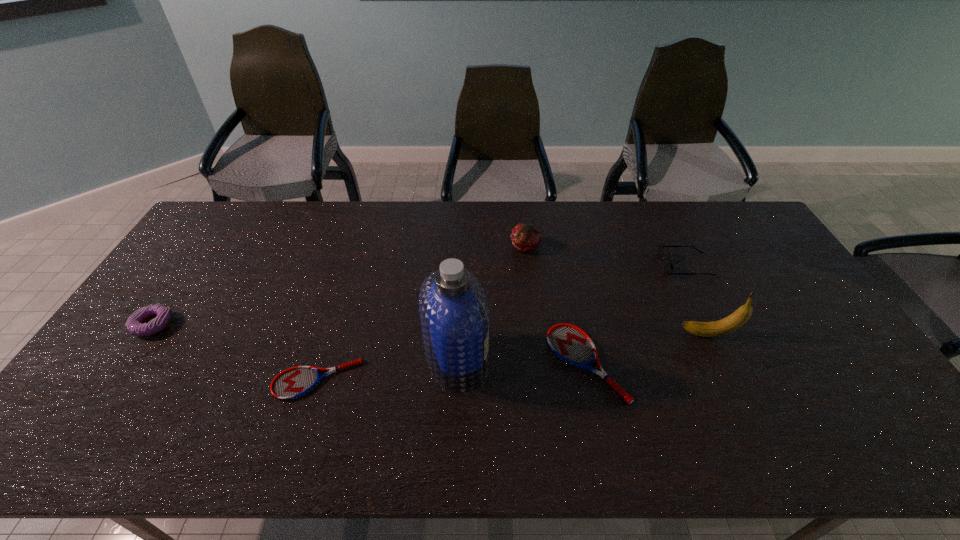
Locate an element on the screen. The height and width of the screenshot is (540, 960). cleansing agent is located at coordinates (454, 310).

Identify the location of free space located 0.190m on the left of the sixth object from right to left. The height and width of the screenshot is (540, 960). (201, 380).

Where is `free region located on the back of the second shortest object`? free region located on the back of the second shortest object is located at coordinates tap(563, 251).

Where is `free space located on the front of the fifth shortest object`? This screenshot has height=540, width=960. free space located on the front of the fifth shortest object is located at coordinates (534, 322).

At what (x,y) coordinates should I click in order to perform the action: click on free spot located 0.240m at the start of the peel on the banana. Please return your answer as a coordinate pair (x, y). Looking at the image, I should click on (593, 334).

You are a GUI agent. You are given a task and a screenshot of the screen. Output one action in this format:
    pyautogui.click(x=<x>, y=<y>)
    Task: Click on the vacant space situated at the start of the peel on the banana
    
    Given the screenshot: What is the action you would take?
    pyautogui.click(x=561, y=334)

Locate an element on the screen. Image resolution: width=960 pixels, height=540 pixels. vacant space located 0.320m at the start of the peel on the banana is located at coordinates (564, 334).

At what (x,y) coordinates should I click in order to perform the action: click on free space located 0.150m on the front-facing side of the sunglasses. Please return your answer as a coordinate pair (x, y). The height and width of the screenshot is (540, 960). Looking at the image, I should click on (614, 265).

Identify the location of free space located on the front-facing side of the sunglasses. (588, 265).

The height and width of the screenshot is (540, 960). In order to click on vacant space located on the front-facing side of the sunglasses in this screenshot , I will do `click(572, 265)`.